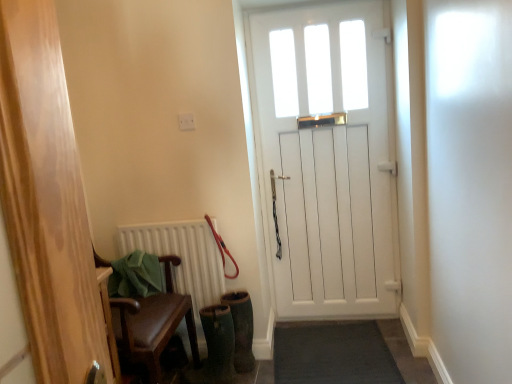
Question: From the image's perspective, is dark gray carpet at lower center beneath white matte radiator at lower left?

Choices:
 (A) no
 (B) yes

Answer: (B)

Question: Is the position of dark gray carpet at lower center less distant than that of white matte radiator at lower left?

Choices:
 (A) no
 (B) yes

Answer: (B)

Question: Is dark gray carpet at lower center oriented away from white matte radiator at lower left?

Choices:
 (A) yes
 (B) no

Answer: (B)

Question: Can you confirm if dark gray carpet at lower center is positioned to the right of white matte radiator at lower left?

Choices:
 (A) yes
 (B) no

Answer: (A)

Question: Is dark gray carpet at lower center outside of white matte radiator at lower left?

Choices:
 (A) no
 (B) yes

Answer: (B)

Question: Considering the relative sizes of dark gray carpet at lower center and white matte radiator at lower left in the image provided, is dark gray carpet at lower center bigger than white matte radiator at lower left?

Choices:
 (A) yes
 (B) no

Answer: (A)

Question: Is red rubber leash at center oriented towards white matte radiator at lower left?

Choices:
 (A) yes
 (B) no

Answer: (A)

Question: From the image's perspective, would you say red rubber leash at center is positioned over white matte radiator at lower left?

Choices:
 (A) yes
 (B) no

Answer: (A)

Question: Considering the relative sizes of red rubber leash at center and white matte radiator at lower left in the image provided, is red rubber leash at center wider than white matte radiator at lower left?

Choices:
 (A) no
 (B) yes

Answer: (B)

Question: Can you confirm if red rubber leash at center is positioned to the right of white matte radiator at lower left?

Choices:
 (A) no
 (B) yes

Answer: (B)

Question: From a real-world perspective, is red rubber leash at center beneath white matte radiator at lower left?

Choices:
 (A) no
 (B) yes

Answer: (A)

Question: From the image's perspective, is red rubber leash at center under white matte radiator at lower left?

Choices:
 (A) no
 (B) yes

Answer: (A)

Question: Is white wooden door at center at the back of green suede boot at lower center?

Choices:
 (A) yes
 (B) no

Answer: (B)